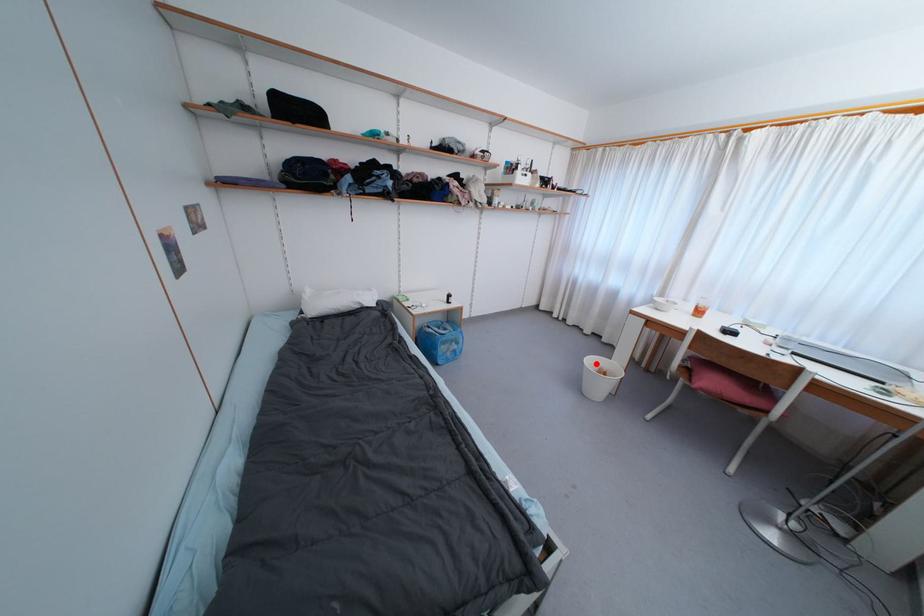
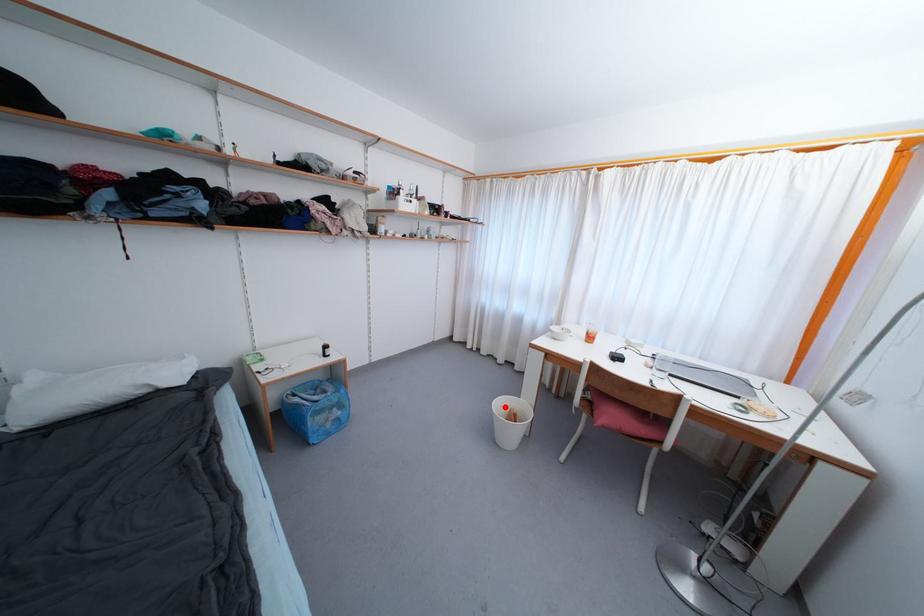
I am providing you with two images of the same scene from different viewpoints. A red point is marked on the first image and another point is marked on the second image. Is the marked point in image1 the same physical position as the marked point in image2?

Yes